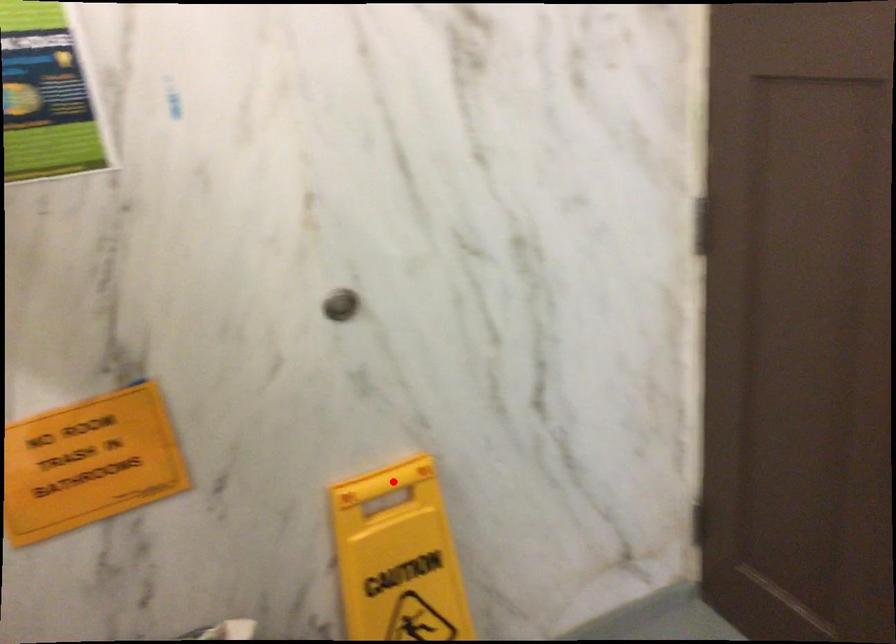
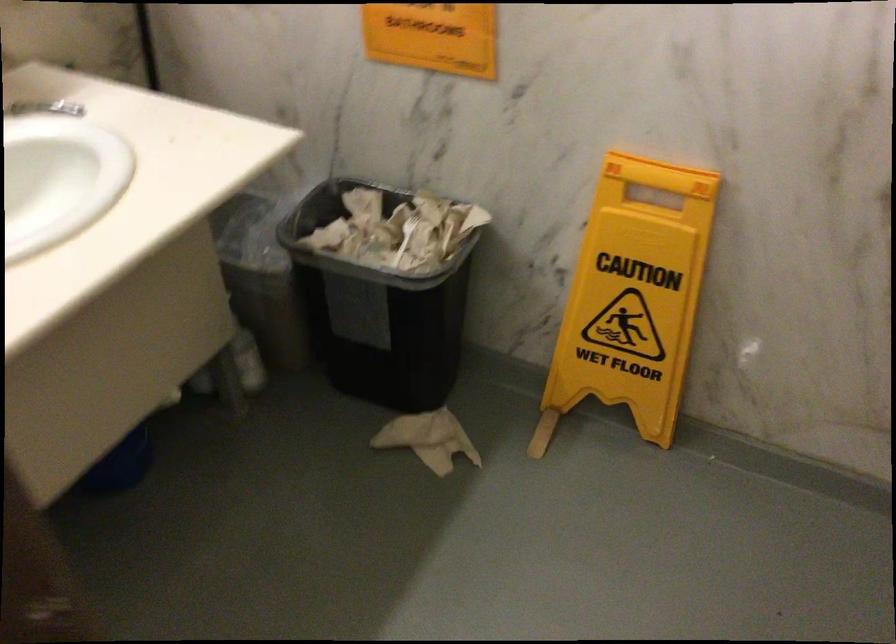
Locate, in the second image, the point that corresponds to the highlighted location in the first image.

(659, 175)